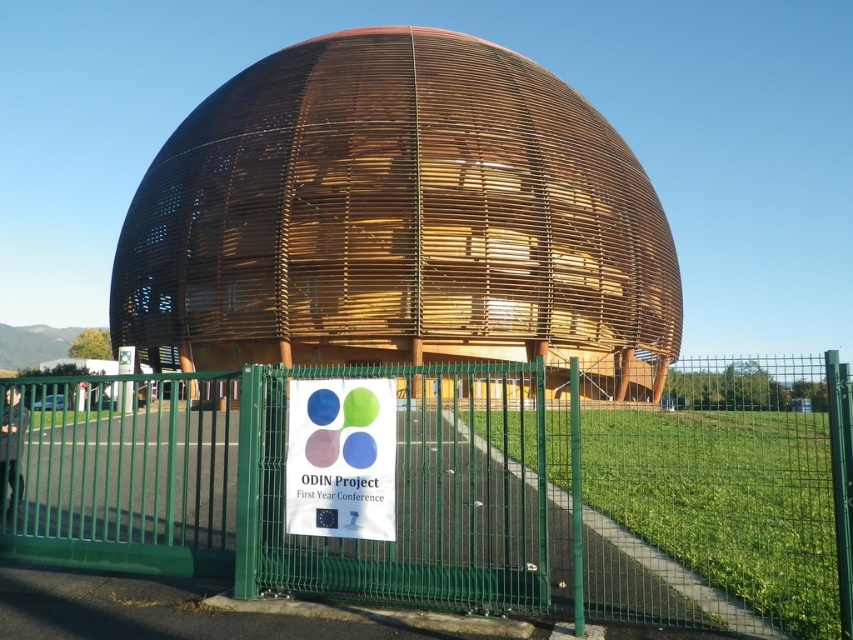
You are standing in front of the large wooden sphere and looking towards the entrance. Which object is closer to you between the green metal fence at center and the matte plastic sign at center?

The green metal fence at center is closer to you since it is positioned to the left of the matte plastic sign at center, which is further away.

You are standing in front of the green metal fence with the open gate. You want to walk towards the large wooden structure. Which direction should you move to reach the wooden at center?

The wooden at center is located at point (398, 220), so you should move towards the center of the image to reach it.